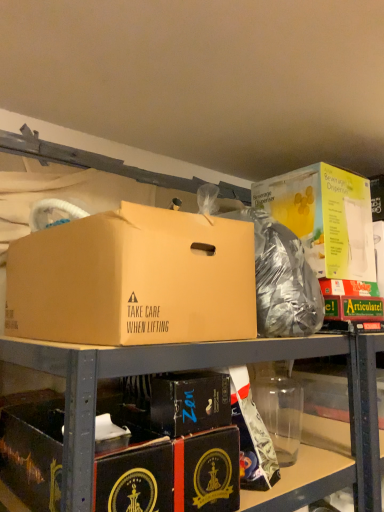
Question: Which direction should I rotate to look at black cardboard box at center, which ranks as the second box in bottom-to-top order, — up or down?

Choices:
 (A) down
 (B) up

Answer: (A)

Question: In which direction should I rotate to look at brown cardboard box at center, positioned as the third box in bottom-to-top order?

Choices:
 (A) left
 (B) right

Answer: (A)

Question: Can you confirm if shiny metallic bag at center is positioned to the left of yellow cardboard beverage dispenser at upper right, the 4th box from the bottom?

Choices:
 (A) no
 (B) yes

Answer: (B)

Question: Does shiny metallic bag at center have a larger size compared to yellow cardboard beverage dispenser at upper right, the 4th box from the bottom?

Choices:
 (A) yes
 (B) no

Answer: (B)

Question: From the image's perspective, is shiny metallic bag at center located beneath yellow cardboard beverage dispenser at upper right, the 4th box from the bottom?

Choices:
 (A) yes
 (B) no

Answer: (A)

Question: Does shiny metallic bag at center come in front of yellow cardboard beverage dispenser at upper right, which ranks as the first box in top-to-bottom order?

Choices:
 (A) yes
 (B) no

Answer: (A)

Question: Does shiny metallic bag at center have a lesser width compared to yellow cardboard beverage dispenser at upper right, which ranks as the first box in top-to-bottom order?

Choices:
 (A) no
 (B) yes

Answer: (B)

Question: Considering the relative positions of shiny metallic bag at center and yellow cardboard beverage dispenser at upper right, the 4th box from the bottom, in the image provided, is shiny metallic bag at center behind yellow cardboard beverage dispenser at upper right, the 4th box from the bottom,?

Choices:
 (A) yes
 (B) no

Answer: (B)

Question: Is yellow cardboard beverage dispenser at upper right, the 4th box from the bottom, to the left of black cardboard box at center, which ranks as the second box in bottom-to-top order, from the viewer's perspective?

Choices:
 (A) yes
 (B) no

Answer: (B)

Question: Does yellow cardboard beverage dispenser at upper right, which ranks as the first box in top-to-bottom order, have a smaller size compared to black cardboard box at center, which ranks as the second box in bottom-to-top order?

Choices:
 (A) yes
 (B) no

Answer: (B)

Question: Is yellow cardboard beverage dispenser at upper right, the 4th box from the bottom, turned away from black cardboard box at center, which ranks as the second box in bottom-to-top order?

Choices:
 (A) yes
 (B) no

Answer: (B)

Question: Considering the relative positions of yellow cardboard beverage dispenser at upper right, the 4th box from the bottom, and black cardboard box at center, which ranks as the second box in bottom-to-top order, in the image provided, is yellow cardboard beverage dispenser at upper right, the 4th box from the bottom, in front of black cardboard box at center, which ranks as the second box in bottom-to-top order,?

Choices:
 (A) no
 (B) yes

Answer: (A)

Question: Considering the relative sizes of yellow cardboard beverage dispenser at upper right, which ranks as the first box in top-to-bottom order, and black cardboard box at center, which ranks as the second box in bottom-to-top order, in the image provided, is yellow cardboard beverage dispenser at upper right, which ranks as the first box in top-to-bottom order, bigger than black cardboard box at center, which ranks as the second box in bottom-to-top order,?

Choices:
 (A) yes
 (B) no

Answer: (A)

Question: From a real-world perspective, is yellow cardboard beverage dispenser at upper right, which ranks as the first box in top-to-bottom order, below black cardboard box at center, which ranks as the second box in bottom-to-top order?

Choices:
 (A) yes
 (B) no

Answer: (B)

Question: Does black cardboard box at lower left, marked as the first box in a bottom-to-top arrangement, touch black cardboard box at center, acting as the third box starting from the top?

Choices:
 (A) yes
 (B) no

Answer: (B)